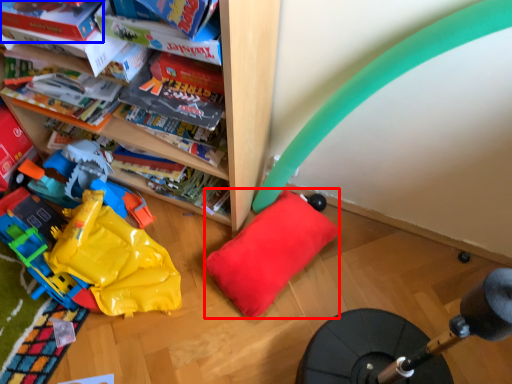
Question: Which object is further to the camera taking this photo, pillow (highlighted by a red box) or book (highlighted by a blue box)?

Choices:
 (A) pillow
 (B) book

Answer: (A)